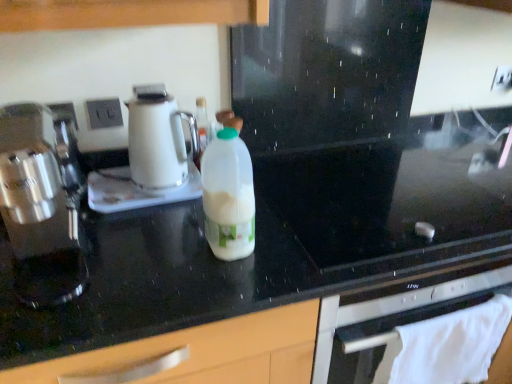
Question: Is the position of white cloth towel at lower right less distant than that of satin silver coffee maker at left, which is counted as the second kitchen appliance, starting from the back?

Choices:
 (A) yes
 (B) no

Answer: (B)

Question: Can you confirm if white cloth towel at lower right is positioned to the right of satin silver coffee maker at left, which is counted as the second kitchen appliance, starting from the back?

Choices:
 (A) no
 (B) yes

Answer: (B)

Question: Is white cloth towel at lower right far from satin silver coffee maker at left, arranged as the 1th kitchen appliance when viewed from the front?

Choices:
 (A) yes
 (B) no

Answer: (B)

Question: Is white cloth towel at lower right bigger than satin silver coffee maker at left, arranged as the 1th kitchen appliance when viewed from the front?

Choices:
 (A) yes
 (B) no

Answer: (B)

Question: Would you say white cloth towel at lower right contains satin silver coffee maker at left, which is counted as the second kitchen appliance, starting from the back?

Choices:
 (A) yes
 (B) no

Answer: (B)

Question: From a real-world perspective, is white cloth towel at lower right positioned under satin silver coffee maker at left, arranged as the 1th kitchen appliance when viewed from the front, based on gravity?

Choices:
 (A) no
 (B) yes

Answer: (B)

Question: Is white plastic bottle at center closer to the viewer compared to white glossy electric kettle at center, the second kitchen appliance from the front?

Choices:
 (A) yes
 (B) no

Answer: (A)

Question: Is white plastic bottle at center far from white glossy electric kettle at center, acting as the first kitchen appliance starting from the back?

Choices:
 (A) yes
 (B) no

Answer: (B)

Question: Is white plastic bottle at center shorter than white glossy electric kettle at center, acting as the first kitchen appliance starting from the back?

Choices:
 (A) yes
 (B) no

Answer: (B)

Question: Can you confirm if white plastic bottle at center is bigger than white glossy electric kettle at center, the second kitchen appliance from the front?

Choices:
 (A) yes
 (B) no

Answer: (B)

Question: Does white plastic bottle at center have a greater height compared to white glossy electric kettle at center, the second kitchen appliance from the front?

Choices:
 (A) no
 (B) yes

Answer: (B)

Question: Is white plastic bottle at center thinner than white glossy electric kettle at center, the second kitchen appliance from the front?

Choices:
 (A) no
 (B) yes

Answer: (B)

Question: Considering the relative sizes of black glass gas stove at center and white plastic bottle at center in the image provided, is black glass gas stove at center thinner than white plastic bottle at center?

Choices:
 (A) no
 (B) yes

Answer: (A)